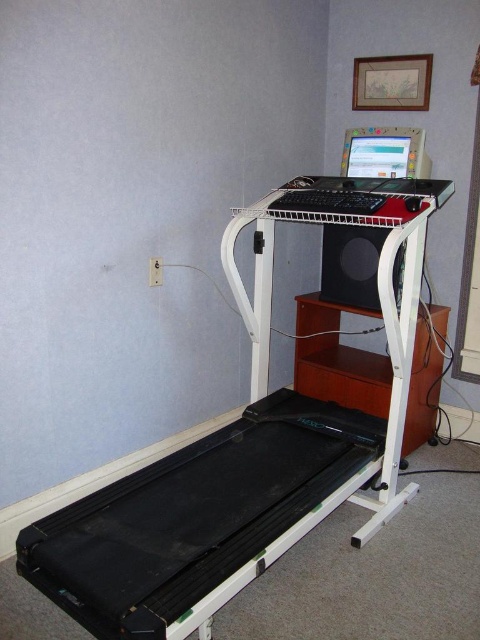
From the picture: Can you confirm if black rubber treadmill at lower left is bigger than white plastic computer desk at center?

Correct, black rubber treadmill at lower left is larger in size than white plastic computer desk at center.

Who is positioned more to the right, black rubber treadmill at lower left or white plastic computer desk at center?

white plastic computer desk at center

Between point (277, 452) and point (393, 326), which one is positioned in front?

Point (393, 326) is more forward.

You are a GUI agent. You are given a task and a screenshot of the screen. Output one action in this format:
    pyautogui.click(x=<x>, y=<y>)
    Task: Click on the black rubber treadmill at lower left
    The height and width of the screenshot is (640, 480).
    Given the screenshot: What is the action you would take?
    pyautogui.click(x=243, y=449)

Which is in front, point (391, 230) or point (362, 145)?

Point (391, 230)

Can you confirm if white plastic computer desk at center is positioned below matte plastic monitor at upper center?

Yes, white plastic computer desk at center is below matte plastic monitor at upper center.

What do you see at coordinates (321, 221) in the screenshot? The width and height of the screenshot is (480, 640). I see `white plastic computer desk at center` at bounding box center [321, 221].

Find the location of a particular element. The image size is (480, 640). white plastic computer desk at center is located at coordinates (321, 221).

The height and width of the screenshot is (640, 480). What do you see at coordinates (350, 266) in the screenshot?
I see `black matte speaker at center` at bounding box center [350, 266].

Which is more to the left, black matte speaker at center or matte plastic monitor at upper center?

black matte speaker at center is more to the left.

Is point (361, 259) in front of point (414, 173)?

No, it is not.

Identify the location of black matte speaker at center. This screenshot has height=640, width=480. (350, 266).